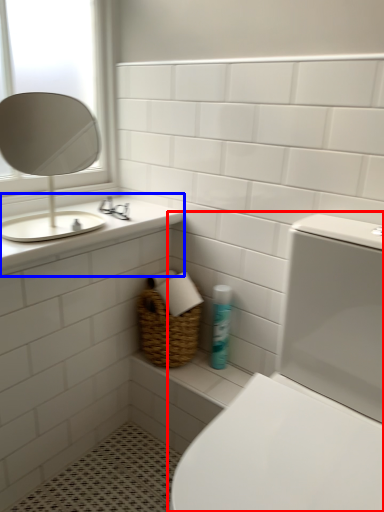
Question: Which of the following is the farthest to the observer, toilet (highlighted by a red box) or counter top (highlighted by a blue box)?

Choices:
 (A) toilet
 (B) counter top

Answer: (B)